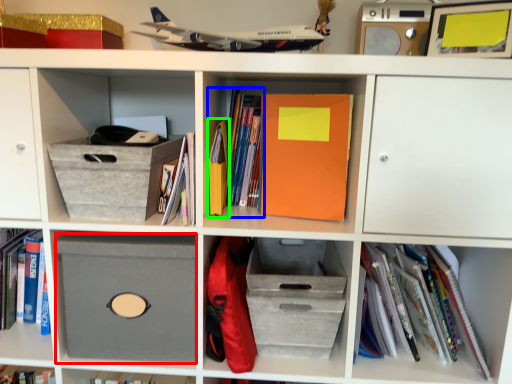
Question: Considering the real-world distances, which object is farthest from cardboard box (highlighted by a red box)? book (highlighted by a blue box) or paperback book (highlighted by a green box)?

Choices:
 (A) book
 (B) paperback book

Answer: (A)